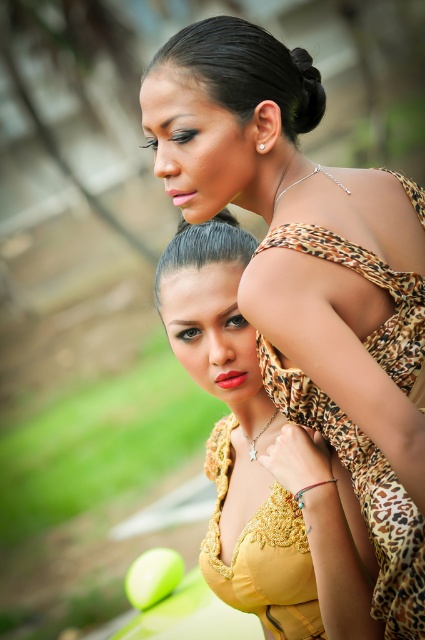
Question: Is leopard print dress at upper center positioned before leopard print fabric dress at upper right?

Choices:
 (A) yes
 (B) no

Answer: (A)

Question: Is leopard print fabric dress at upper right bigger than black silky hair at upper center?

Choices:
 (A) no
 (B) yes

Answer: (B)

Question: Which point is farther to the camera?

Choices:
 (A) yellow satin dress at center
 (B) leopard print fabric dress at upper right
 (C) sleek black hair at upper center
 (D) leopard print dress at upper center

Answer: (A)

Question: Which point is closer to the camera?

Choices:
 (A) (217, 124)
 (B) (166, 52)
 (C) (269, 362)

Answer: (A)

Question: Which object is the farthest from the leopard print dress at upper center?

Choices:
 (A) black silky hair at upper center
 (B) sleek black hair at upper center
 (C) leopard print fabric dress at upper right
 (D) yellow satin dress at center

Answer: (D)

Question: Does leopard print dress at upper center have a greater width compared to leopard print fabric dress at upper right?

Choices:
 (A) yes
 (B) no

Answer: (A)